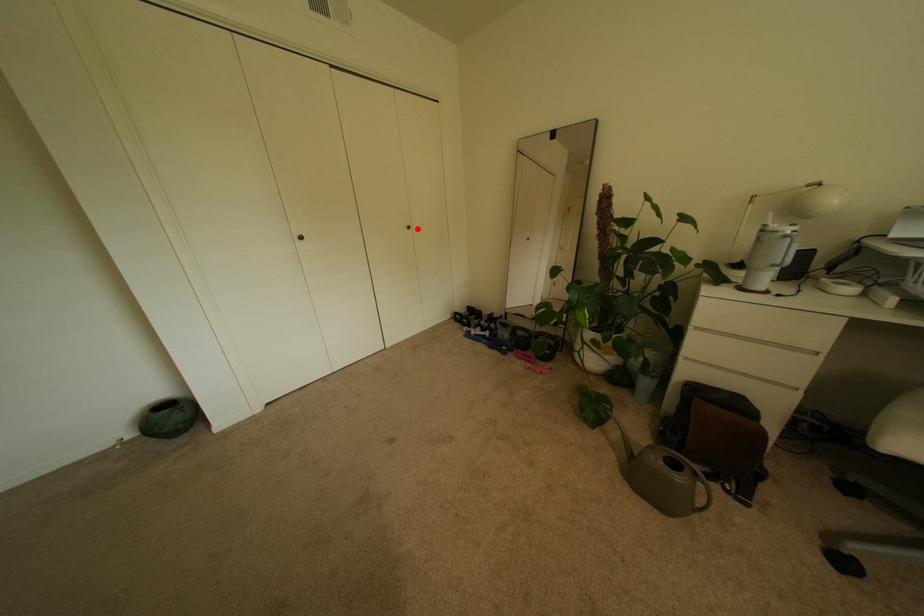
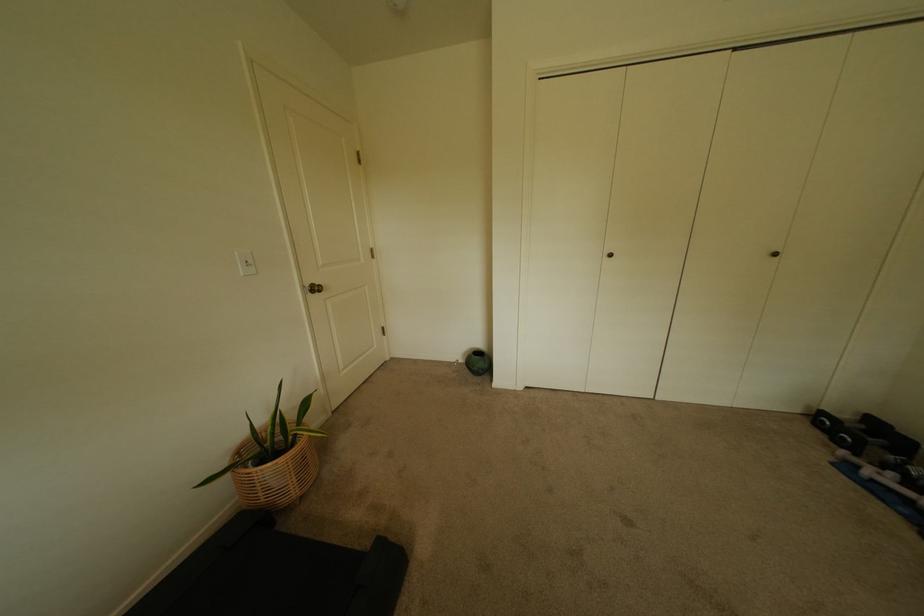
Where in the second image is the point corresponding to the highlighted location from the first image?

(784, 256)